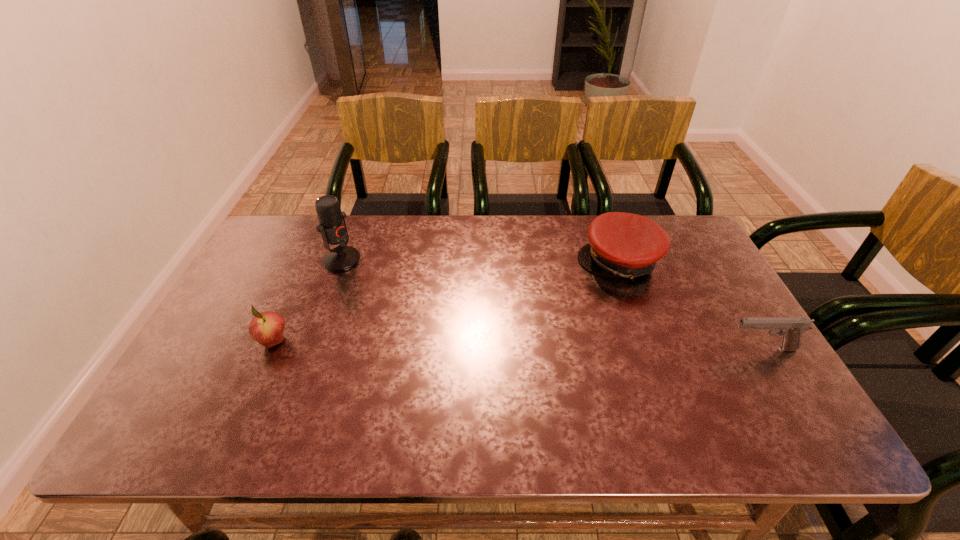
I want to click on blank space that satisfies the following two spatial constraints: 1. on the back side of the microphone; 2. on the left side of the leftmost object, so click(x=310, y=260).

You are a GUI agent. You are given a task and a screenshot of the screen. Output one action in this format:
    pyautogui.click(x=<x>, y=<y>)
    Task: Click on the vacant space that satisfies the following two spatial constraints: 1. on the front side of the rightmost object; 2. at the barrel of the apple
    The width and height of the screenshot is (960, 540).
    Given the screenshot: What is the action you would take?
    pyautogui.click(x=271, y=349)

Find the location of a particular element. Image resolution: width=960 pixels, height=540 pixels. free spot that satisfies the following two spatial constraints: 1. on the front side of the apple; 2. at the barrel of the rightmost object is located at coordinates (271, 349).